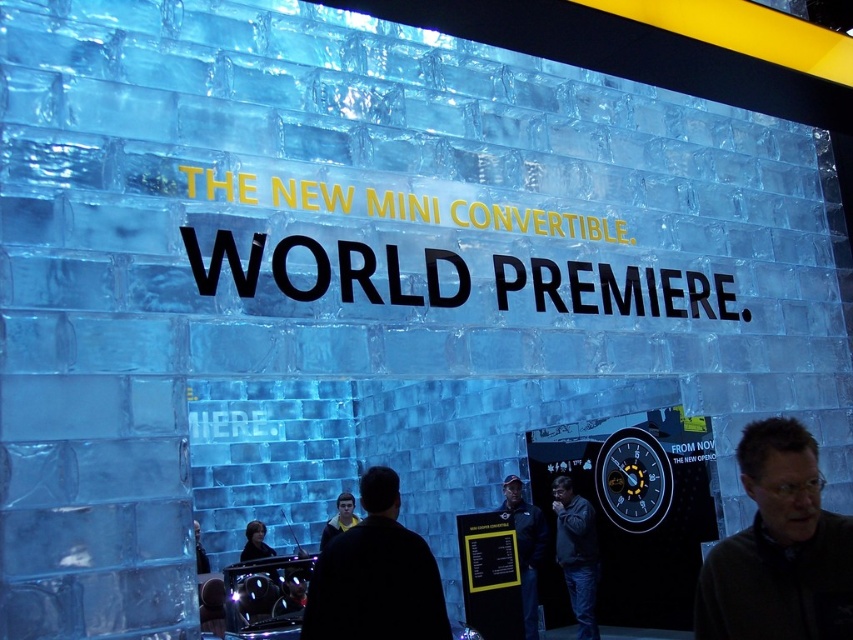
Question: Which is nearer to the dark blue jacket at center?

Choices:
 (A) dark gray sweater at center
 (B) black matte jacket at center

Answer: (B)

Question: Which of the following is the closest to the observer?

Choices:
 (A) (334, 564)
 (B) (560, 516)

Answer: (A)

Question: Does dark gray sweater at center appear over black matte jacket at center?

Choices:
 (A) no
 (B) yes

Answer: (B)

Question: Which point appears closest to the camera in this image?

Choices:
 (A) (851, 566)
 (B) (569, 497)
 (C) (521, 502)
 (D) (422, 600)

Answer: (A)

Question: Does dark gray jacket at center appear on the right side of dark blue jacket at center?

Choices:
 (A) no
 (B) yes

Answer: (B)

Question: Does dark gray sweater at center appear over dark blue jacket at center?

Choices:
 (A) no
 (B) yes

Answer: (B)